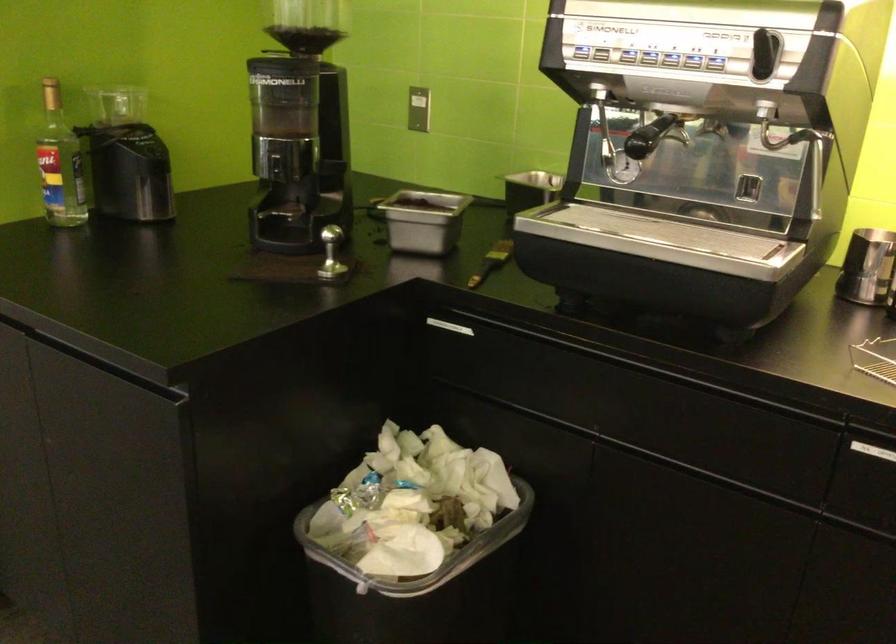
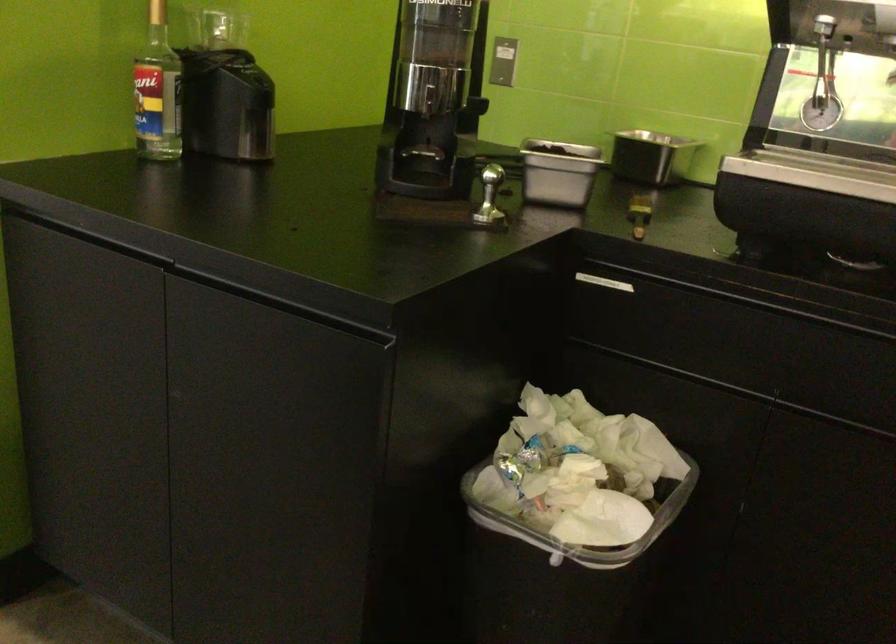
Locate, in the second image, the point that corresponds to the point at 415,225 in the first image.

(558, 172)